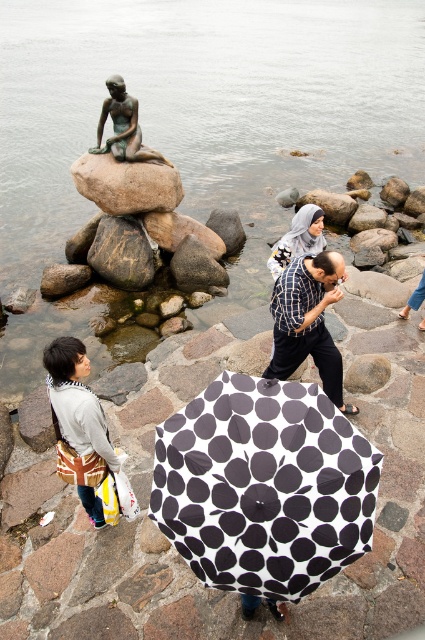
Question: Which point appears farthest from the camera in this image?

Choices:
 (A) (79, 164)
 (B) (319, 324)
 (C) (110, 77)

Answer: (A)

Question: Is gray fabric bag at lower left smaller than white textured hijab at center?

Choices:
 (A) no
 (B) yes

Answer: (A)

Question: Considering the real-world distances, which object is closest to the transparent water at statue left?

Choices:
 (A) black dotted fabric umbrella at center
 (B) gray fabric bag at lower left

Answer: (A)

Question: Is transparent water at statue left bigger than black dotted fabric umbrella at center?

Choices:
 (A) no
 (B) yes

Answer: (B)

Question: Can you confirm if transparent water at statue left is positioned to the left of white textured hijab at center?

Choices:
 (A) no
 (B) yes

Answer: (B)

Question: Among these points, which one is farthest from the camera?

Choices:
 (A) (113, 154)
 (B) (108, 451)
 (C) (79, 173)
 (D) (268, 548)

Answer: (C)